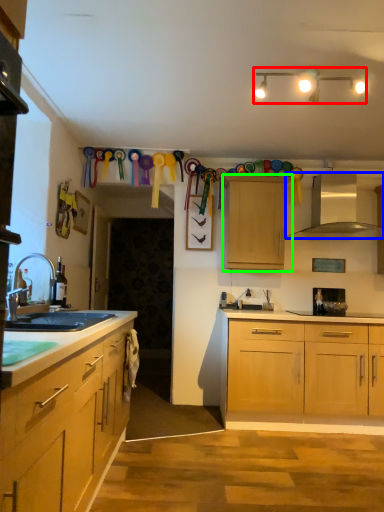
Question: Which object is positioned closest to lamp (highlighted by a red box)? Select from exhaust hood (highlighted by a blue box) and cabinetry (highlighted by a green box).

Choices:
 (A) exhaust hood
 (B) cabinetry

Answer: (B)